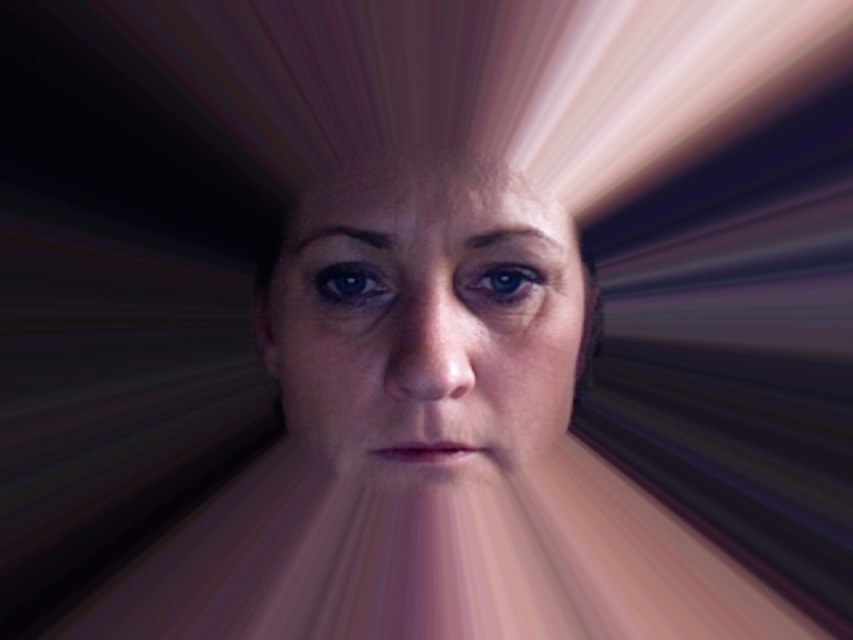
Is blue glossy eye at center smaller than matte blue eye at center?

Indeed, blue glossy eye at center has a smaller size compared to matte blue eye at center.

Is blue glossy eye at center to the right of matte blue eye at center from the viewer's perspective?

Correct, you'll find blue glossy eye at center to the right of matte blue eye at center.

Between point (474, 282) and point (354, 268), which one is positioned in front?

Point (474, 282) is more forward.

This screenshot has height=640, width=853. What are the coordinates of `blue glossy eye at center` in the screenshot? It's located at (500, 284).

Can you confirm if smooth skin face at center is positioned to the left of blue glossy eye at center?

Yes, smooth skin face at center is to the left of blue glossy eye at center.

Does smooth skin face at center have a greater width compared to blue glossy eye at center?

Yes.

What do you see at coordinates (426, 323) in the screenshot? The width and height of the screenshot is (853, 640). I see `smooth skin face at center` at bounding box center [426, 323].

At what (x,y) coordinates should I click in order to perform the action: click on smooth skin face at center. Please return your answer as a coordinate pair (x, y). This screenshot has height=640, width=853. Looking at the image, I should click on (426, 323).

Does smooth skin face at center have a greater height compared to matte blue eye at center?

Indeed, smooth skin face at center has a greater height compared to matte blue eye at center.

Does point (558, 348) come behind point (360, 291)?

Yes.

This screenshot has width=853, height=640. Identify the location of smooth skin face at center. 426,323.